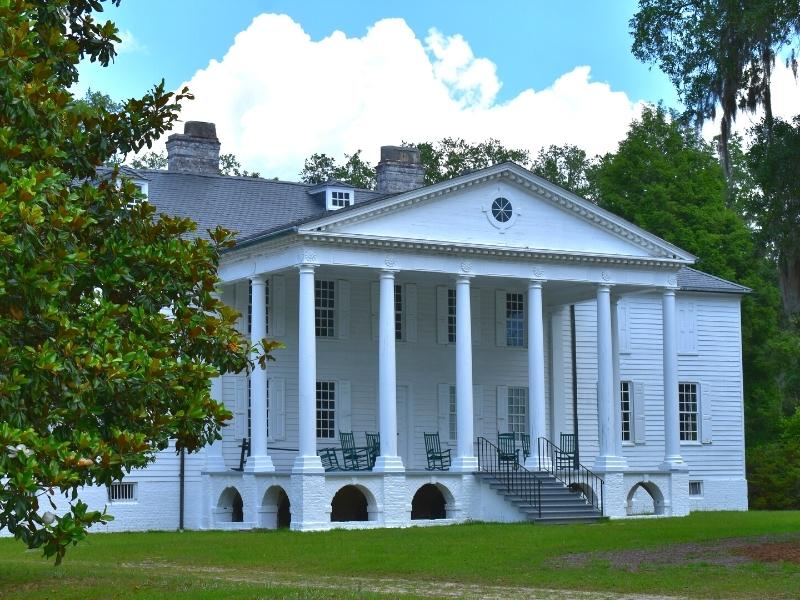
This screenshot has width=800, height=600. In order to click on windows in this screenshot , I will do `click(689, 420)`, `click(625, 418)`.